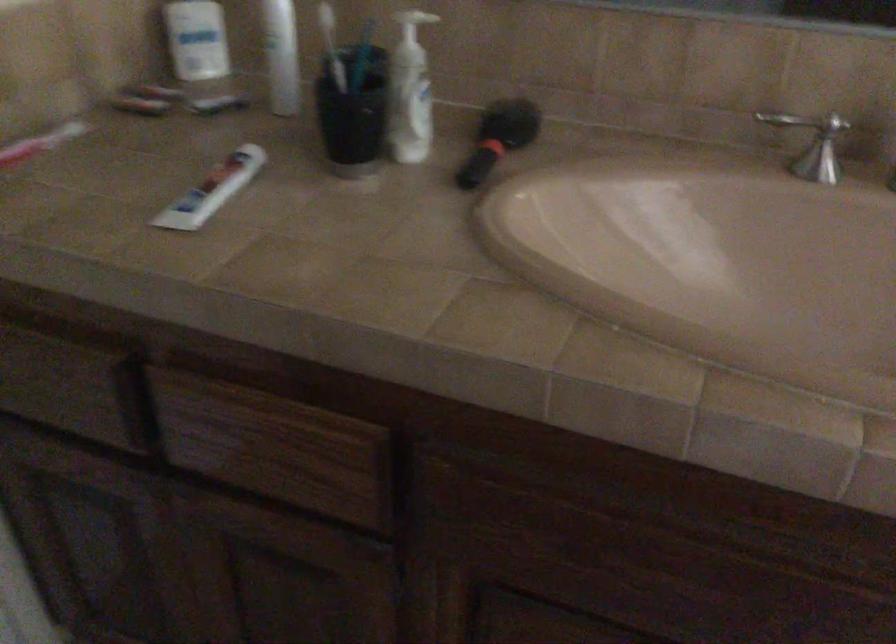
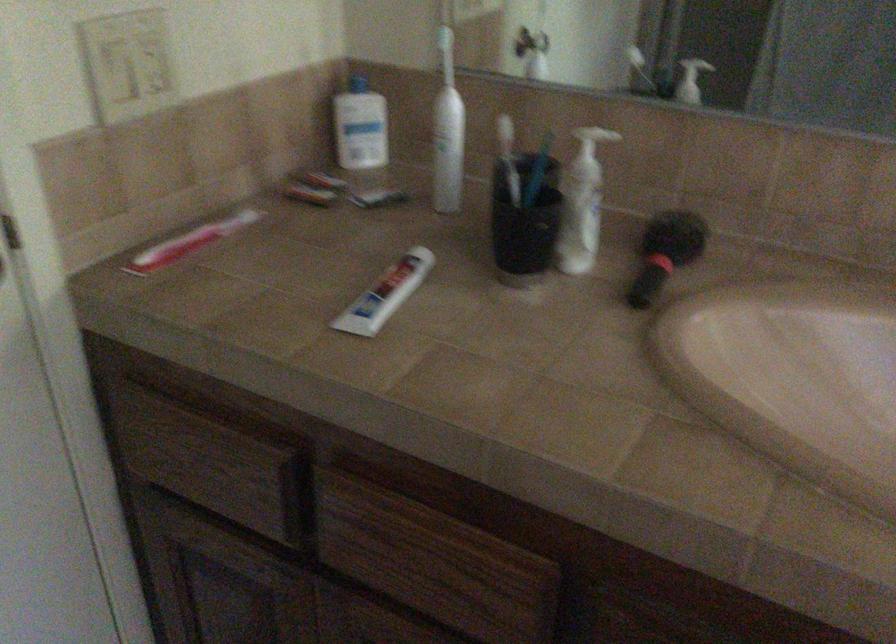
Locate, in the second image, the point that corresponds to pixel 210 192 in the first image.

(385, 294)